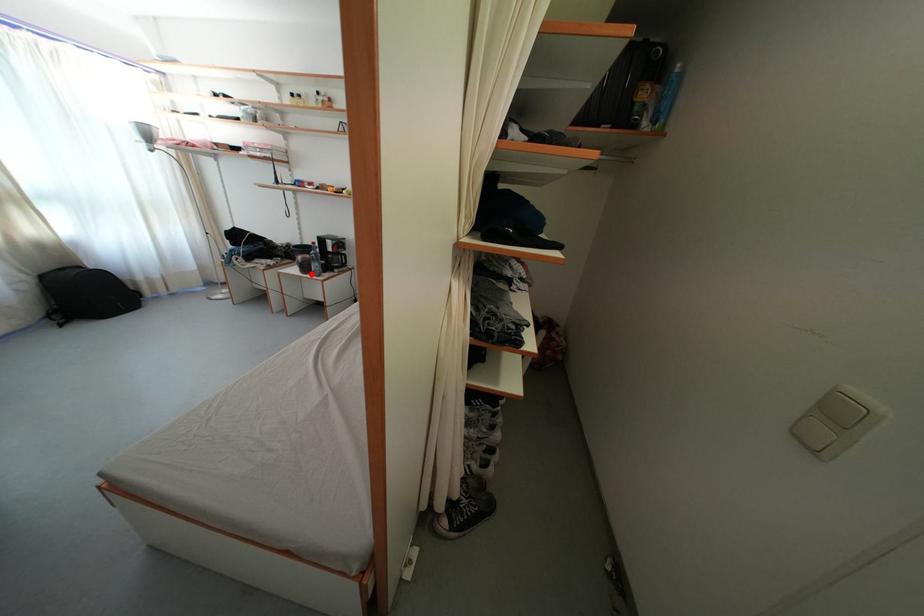
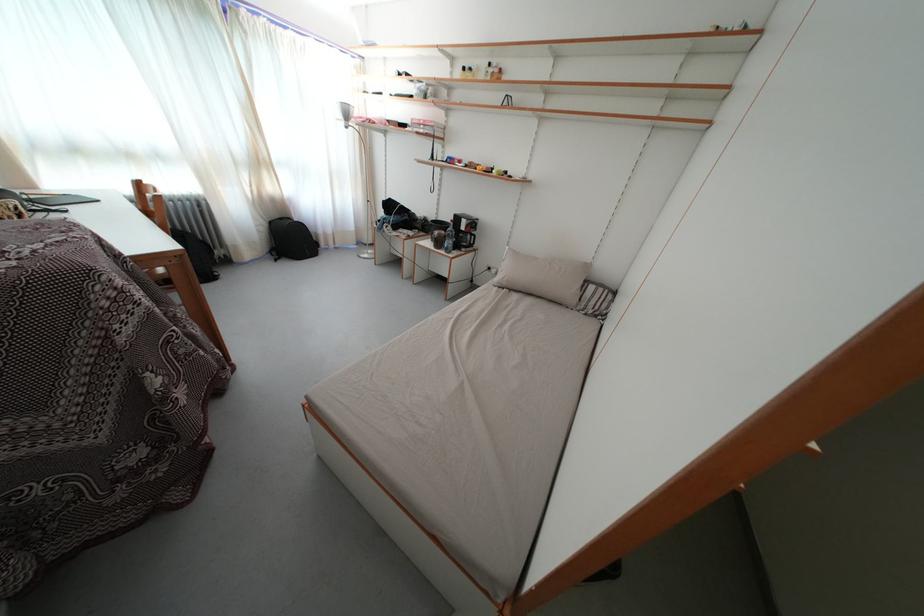
Question: A red point is marked in image1. In image2, is the corresponding 3D point closer to the camera or farther? Reply with the corresponding letter.

Choices:
 (A) The corresponding 3D point is closer.
 (B) The corresponding 3D point is farther.

Answer: (A)